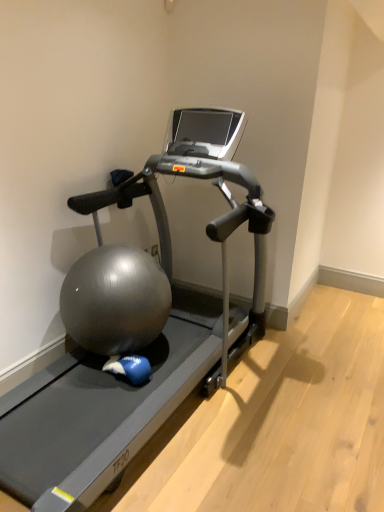
Locate an element on the screen. silver metallic treadmill at center is located at coordinates (134, 330).

This screenshot has width=384, height=512. Describe the element at coordinates (134, 330) in the screenshot. I see `silver metallic treadmill at center` at that location.

What are the coordinates of `silver metallic treadmill at center` in the screenshot? It's located at (134, 330).